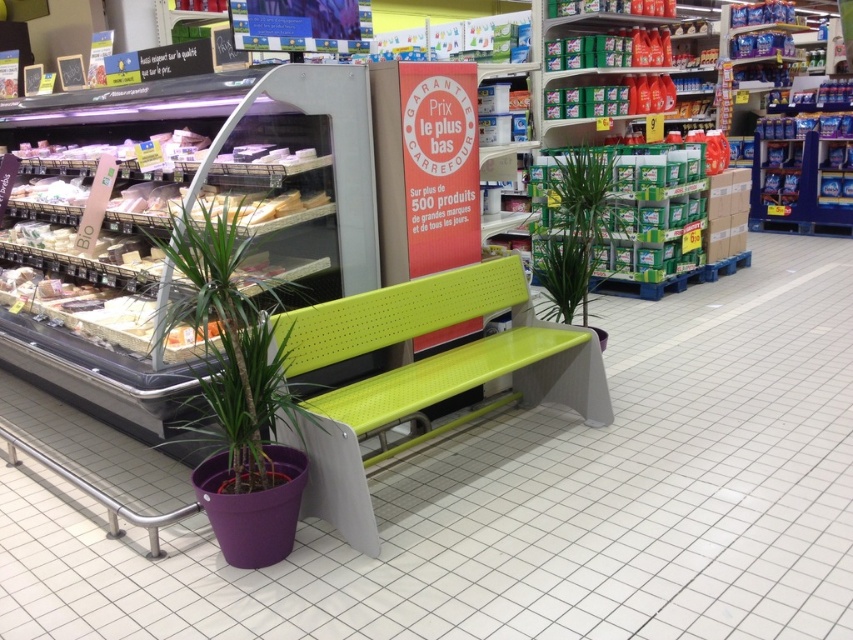
Question: Which object is the closest to the purple plastic pot at lower left?

Choices:
 (A) green plastic bench at center
 (B) green leafy plant at center
 (C) lime green plastic bench at center

Answer: (C)

Question: Is purple plastic pot at lower left smaller than green leafy plant at center?

Choices:
 (A) yes
 (B) no

Answer: (B)

Question: Is lime green plastic bench at center wider than green leafy plant at center?

Choices:
 (A) yes
 (B) no

Answer: (A)

Question: Which point is farther to the camera?

Choices:
 (A) purple plastic pot at lower left
 (B) green leafy plant at center
 (C) lime green plastic bench at center

Answer: (B)

Question: In this image, where is green plastic bench at center located relative to purple plastic pot at lower left?

Choices:
 (A) above
 (B) below

Answer: (B)

Question: Which of these objects is positioned farthest from the purple plastic pot at lower left?

Choices:
 (A) green leafy plant at center
 (B) green plastic bench at center
 (C) lime green plastic bench at center

Answer: (A)